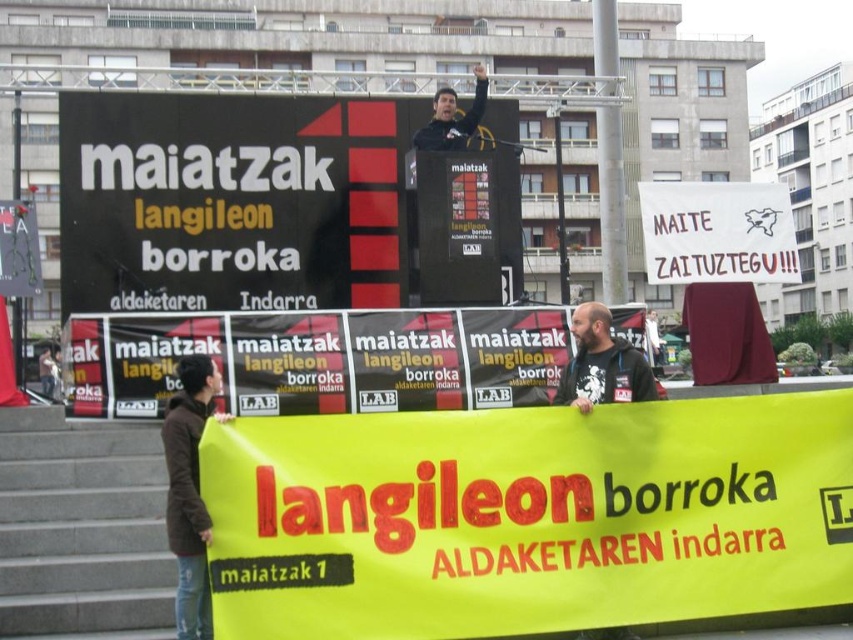
You are a photographer standing at the front of the event. You want to take a photo that includes both the yellow fabric banner at lower center and the black matte scoreboard at upper center. Given that your camera has a maximum focus range of 10 meters, will you be able to capture both objects in focus simultaneously?

The yellow fabric banner at lower center is 11.32 meters away from the black matte scoreboard at upper center. Since the distance between them exceeds the camera maximum focus range of 10 meters, you cannot capture both in focus simultaneously.